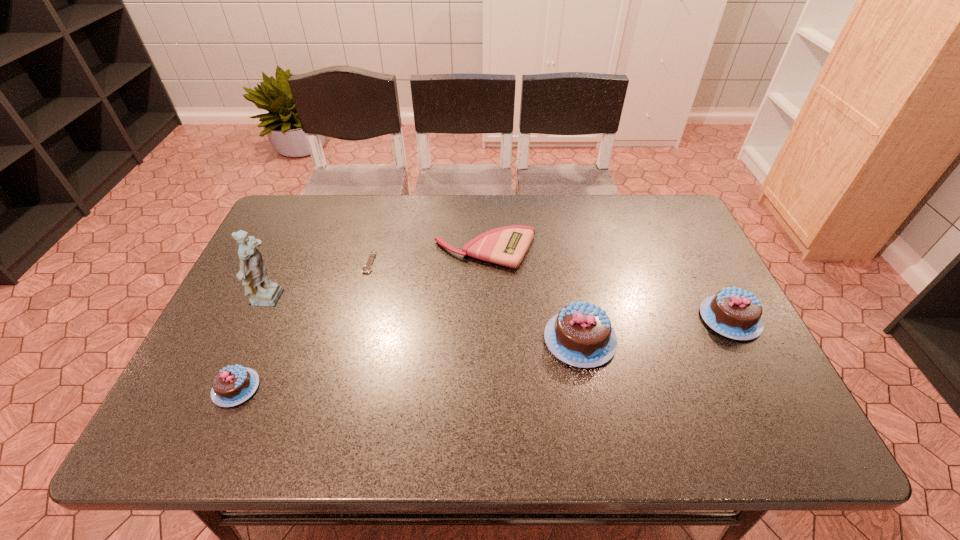
You are a GUI agent. You are given a task and a screenshot of the screen. Output one action in this format:
    pyautogui.click(x=<x>, y=<y>)
    Task: Click on the free space that satisfies the following two spatial constraints: 1. on the front side of the second chocolate cake from left to right; 2. on the right side of the third object from left to right
    The image size is (960, 540).
    Given the screenshot: What is the action you would take?
    pyautogui.click(x=349, y=340)

Where is `vacant space that satisfies the following two spatial constraints: 1. on the front-facing side of the tallest object; 2. on the back side of the leftmost chocolate cake`? vacant space that satisfies the following two spatial constraints: 1. on the front-facing side of the tallest object; 2. on the back side of the leftmost chocolate cake is located at coordinates (230, 388).

This screenshot has width=960, height=540. Find the location of `vacant region that satisfies the following two spatial constraints: 1. on the front side of the fourth object from right to left; 2. on the front-facing side of the tallest object`. vacant region that satisfies the following two spatial constraints: 1. on the front side of the fourth object from right to left; 2. on the front-facing side of the tallest object is located at coordinates (360, 301).

Find the location of a particular element. vacant space that satisfies the following two spatial constraints: 1. on the back side of the third tallest object; 2. on the right side of the second chocolate cake from right to left is located at coordinates (576, 319).

At what (x,y) coordinates should I click in order to perform the action: click on vacant area that satisfies the following two spatial constraints: 1. on the front-facing side of the tallest object; 2. on the left side of the shortest chocolate cake. Please return your answer as a coordinate pair (x, y). Looking at the image, I should click on (230, 388).

This screenshot has width=960, height=540. In order to click on free region that satisfies the following two spatial constraints: 1. on the front-facing side of the tallest object; 2. on the back side of the rightmost chocolate cake in this screenshot , I will do `click(262, 319)`.